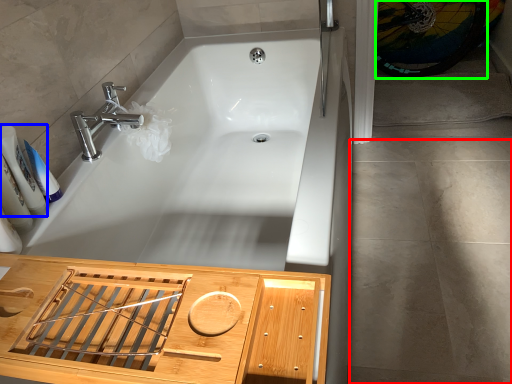
Question: Considering the real-world distances, which object is farthest from concrete (highlighted by a red box)? toiletry (highlighted by a blue box) or bicycle wheel (highlighted by a green box)?

Choices:
 (A) toiletry
 (B) bicycle wheel

Answer: (A)